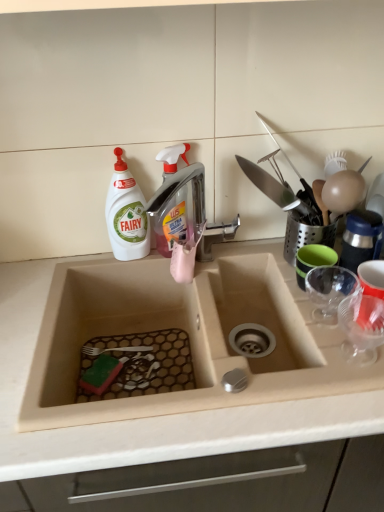
How much space does translucent plastic spray bottle at center, which is the 2th cleaning product in left-to-right order, occupy horizontally?

translucent plastic spray bottle at center, which is the 2th cleaning product in left-to-right order, is 5.87 centimeters in width.

Describe the element at coordinates (180, 199) in the screenshot. This screenshot has width=384, height=512. I see `metallic silver faucet at upper center` at that location.

Locate an element on the screen. transparent plastic cup at right, placed as the 2th tableware when sorted from front to back is located at coordinates (371, 295).

How much space does transparent plastic cup at right, placed as the 2th tableware when sorted from front to back, occupy vertically?

It is 4.59 inches.

Describe the element at coordinates (361, 328) in the screenshot. I see `transparent plastic cup at right, placed as the 1th tableware when sorted from front to back` at that location.

Image resolution: width=384 pixels, height=512 pixels. Identify the location of translucent plastic spray bottle at center, which is the 2th cleaning product in left-to-right order. [x=172, y=223].

From a real-world perspective, is transparent plastic cup at right, which ranks as the third tableware in back-to-front order, physically located above or below transparent plastic cup at right, placed as the 2th tableware when sorted from front to back?

transparent plastic cup at right, which ranks as the third tableware in back-to-front order, is below transparent plastic cup at right, placed as the 2th tableware when sorted from front to back.

The width and height of the screenshot is (384, 512). Find the location of `tableware lying in front of the transparent plastic cup at right, the 2th tableware positioned from the back`. tableware lying in front of the transparent plastic cup at right, the 2th tableware positioned from the back is located at coordinates (361, 328).

Considering the sizes of objects transparent plastic cup at right, placed as the 1th tableware when sorted from front to back, and transparent plastic cup at right, placed as the 2th tableware when sorted from front to back, in the image provided, who is shorter, transparent plastic cup at right, placed as the 1th tableware when sorted from front to back, or transparent plastic cup at right, placed as the 2th tableware when sorted from front to back,?

transparent plastic cup at right, placed as the 2th tableware when sorted from front to back.

Can you tell me how much transparent plastic cup at right, placed as the 1th tableware when sorted from front to back, and transparent plastic cup at right, placed as the 2th tableware when sorted from front to back, differ in facing direction?

They differ by 0.946 degrees in their facing directions.

In terms of width, does metallic silver faucet at upper center look wider or thinner when compared to transparent plastic cup at right, which ranks as the third tableware in back-to-front order?

Clearly, metallic silver faucet at upper center has more width compared to transparent plastic cup at right, which ranks as the third tableware in back-to-front order.

How many degrees apart are the facing directions of metallic silver faucet at upper center and transparent plastic cup at right, which ranks as the third tableware in back-to-front order?

There is a 20.3-degree angle between the facing directions of metallic silver faucet at upper center and transparent plastic cup at right, which ranks as the third tableware in back-to-front order.

Can we say metallic silver faucet at upper center lies outside transparent plastic cup at right, placed as the 1th tableware when sorted from front to back?

metallic silver faucet at upper center is positioned outside transparent plastic cup at right, placed as the 1th tableware when sorted from front to back.

Which is more to the left, metallic silver faucet at upper center or transparent plastic cup at right, which ranks as the third tableware in back-to-front order?

From the viewer's perspective, metallic silver faucet at upper center appears more on the left side.

From a real-world perspective, between white matte bottle at upper left, marked as the second cleaning product in a right-to-left arrangement, and green rubber cup at right, positioned as the 3th tableware in front-to-back order, who is vertically higher?

white matte bottle at upper left, marked as the second cleaning product in a right-to-left arrangement, is physically above.

Is white matte bottle at upper left, the 1th cleaning product from the left, oriented away from green rubber cup at right, positioned as the 3th tableware in front-to-back order?

No, green rubber cup at right, positioned as the 3th tableware in front-to-back order, is not at the back of white matte bottle at upper left, the 1th cleaning product from the left.

From the image's perspective, does white matte bottle at upper left, the 1th cleaning product from the left, appear higher than green rubber cup at right, positioned as the 3th tableware in front-to-back order?

Correct, white matte bottle at upper left, the 1th cleaning product from the left, appears higher than green rubber cup at right, positioned as the 3th tableware in front-to-back order, in the image.

From the image's perspective, does metallic silver faucet at upper center appear higher than beige matte sink at center?

Correct, metallic silver faucet at upper center appears higher than beige matte sink at center in the image.

Where is `tap behind the beige matte sink at center`? This screenshot has height=512, width=384. tap behind the beige matte sink at center is located at coordinates (180, 199).

Which of these two, metallic silver faucet at upper center or beige matte sink at center, is bigger?

beige matte sink at center is bigger.

From a real-world perspective, is metallic silver faucet at upper center physically located above or below beige matte sink at center?

metallic silver faucet at upper center is situated higher than beige matte sink at center in the real world.

Between beige matte sink at center and transparent plastic cup at right, placed as the 2th tableware when sorted from front to back, which one has larger size?

beige matte sink at center is bigger.

Would you say beige matte sink at center is outside transparent plastic cup at right, placed as the 2th tableware when sorted from front to back?

Yes.

From a real-world perspective, is beige matte sink at center located beneath transparent plastic cup at right, the 2th tableware positioned from the back?

Yes, from a real-world perspective, beige matte sink at center is beneath transparent plastic cup at right, the 2th tableware positioned from the back.

Considering the sizes of transparent plastic cup at right, placed as the 1th tableware when sorted from front to back, and white matte bottle at upper left, the 1th cleaning product from the left, in the image, is transparent plastic cup at right, placed as the 1th tableware when sorted from front to back, wider or thinner than white matte bottle at upper left, the 1th cleaning product from the left,?

transparent plastic cup at right, placed as the 1th tableware when sorted from front to back, is wider than white matte bottle at upper left, the 1th cleaning product from the left.

The width and height of the screenshot is (384, 512). I want to click on the 1st cleaning product behind the transparent plastic cup at right, which ranks as the third tableware in back-to-front order, starting your count from the anchor, so click(126, 214).

Measure the distance from transparent plastic cup at right, which ranks as the third tableware in back-to-front order, to white matte bottle at upper left, marked as the second cleaning product in a right-to-left arrangement.

A distance of 21.61 inches exists between transparent plastic cup at right, which ranks as the third tableware in back-to-front order, and white matte bottle at upper left, marked as the second cleaning product in a right-to-left arrangement.

Are white matte bottle at upper left, the 1th cleaning product from the left, and beige matte sink at center located far from each other?

That's not correct — white matte bottle at upper left, the 1th cleaning product from the left, is a little close to beige matte sink at center.

Is point (121, 255) positioned before point (69, 440)?

That is False.

Considering the relative positions of white matte bottle at upper left, marked as the second cleaning product in a right-to-left arrangement, and beige matte sink at center in the image provided, is white matte bottle at upper left, marked as the second cleaning product in a right-to-left arrangement, to the left or to the right of beige matte sink at center?

From the image, it's evident that white matte bottle at upper left, marked as the second cleaning product in a right-to-left arrangement, is to the left of beige matte sink at center.

Identify the location of tableware in front of the transparent plastic cup at right, the 2th tableware positioned from the back. This screenshot has width=384, height=512. (361, 328).

Identify the location of tap on the left of transparent plastic cup at right, placed as the 1th tableware when sorted from front to back. This screenshot has height=512, width=384. (180, 199).

When comparing their distances from translucent plastic spray bottle at center, which is the 2th cleaning product in left-to-right order, does transparent plastic cup at right, which ranks as the third tableware in back-to-front order, or transparent plastic cup at right, the 2th tableware positioned from the back, seem further?

Among the two, transparent plastic cup at right, the 2th tableware positioned from the back, is located further to translucent plastic spray bottle at center, which is the 2th cleaning product in left-to-right order.

From the picture: Which object lies nearer to the anchor point transparent plastic cup at right, placed as the 1th tableware when sorted from front to back, green rubber cup at right, which appears as the first tableware when viewed from the back, or metallic silver faucet at upper center?

green rubber cup at right, which appears as the first tableware when viewed from the back, is positioned closer to the anchor transparent plastic cup at right, placed as the 1th tableware when sorted from front to back.

Based on their spatial positions, is metallic silver faucet at upper center or white matte bottle at upper left, the 1th cleaning product from the left, further from green rubber cup at right, which appears as the first tableware when viewed from the back?

white matte bottle at upper left, the 1th cleaning product from the left, is positioned further to the anchor green rubber cup at right, which appears as the first tableware when viewed from the back.

From the image, which object appears to be farther from transparent plastic cup at right, the 2th tableware positioned from the back, beige matte sink at center or green rubber cup at right, which appears as the first tableware when viewed from the back?

beige matte sink at center.

Looking at the image, which one is located further to transparent plastic cup at right, placed as the 2th tableware when sorted from front to back, green rubber cup at right, which appears as the first tableware when viewed from the back, or translucent plastic spray bottle at center, which is the 2th cleaning product in left-to-right order?

translucent plastic spray bottle at center, which is the 2th cleaning product in left-to-right order.

Estimate the real-world distances between objects in this image. Which object is further from transparent plastic cup at right, placed as the 2th tableware when sorted from front to back, transparent plastic cup at right, which ranks as the third tableware in back-to-front order, or white matte bottle at upper left, the 1th cleaning product from the left?

Among the two, white matte bottle at upper left, the 1th cleaning product from the left, is located further to transparent plastic cup at right, placed as the 2th tableware when sorted from front to back.

When comparing their distances from green rubber cup at right, positioned as the 3th tableware in front-to-back order, does transparent plastic cup at right, the 2th tableware positioned from the back, or white matte bottle at upper left, marked as the second cleaning product in a right-to-left arrangement, seem closer?

Among the two, transparent plastic cup at right, the 2th tableware positioned from the back, is located nearer to green rubber cup at right, positioned as the 3th tableware in front-to-back order.

Looking at the image, which one is located further to white matte bottle at upper left, marked as the second cleaning product in a right-to-left arrangement, beige matte sink at center or green rubber cup at right, which appears as the first tableware when viewed from the back?

green rubber cup at right, which appears as the first tableware when viewed from the back, is further to white matte bottle at upper left, marked as the second cleaning product in a right-to-left arrangement.

Identify the location of countertop located between white matte bottle at upper left, the 1th cleaning product from the left, and transparent plastic cup at right, placed as the 2th tableware when sorted from front to back, in the left-right direction. (145, 418).

What are the coordinates of `tableware located between white matte bottle at upper left, marked as the second cleaning product in a right-to-left arrangement, and transparent plastic cup at right, placed as the 1th tableware when sorted from front to back, in the left-right direction` in the screenshot? It's located at (312, 260).

Find the location of a particular element. tap between translucent plastic spray bottle at center, which is the 2th cleaning product in left-to-right order, and transparent plastic cup at right, the 2th tableware positioned from the back is located at coordinates (180, 199).

Identify the location of countertop between metallic silver faucet at upper center and transparent plastic cup at right, placed as the 2th tableware when sorted from front to back. (145, 418).